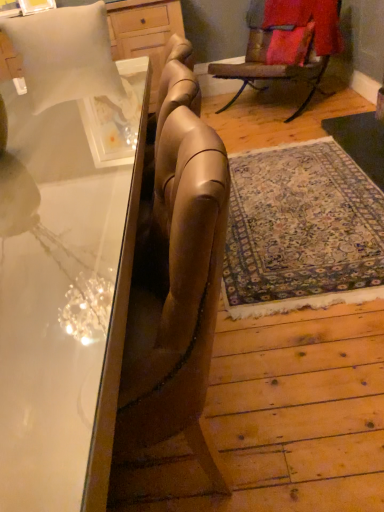
Question: From the image's perspective, is velvet red pillow at upper right, which is the 2th pillow in left-to-right order, below clear glass desk at left?

Choices:
 (A) no
 (B) yes

Answer: (A)

Question: Is velvet red pillow at upper right, which is the 2th pillow in left-to-right order, positioned far away from clear glass desk at left?

Choices:
 (A) yes
 (B) no

Answer: (A)

Question: Is velvet red pillow at upper right, which is the 2th pillow in left-to-right order, smaller than clear glass desk at left?

Choices:
 (A) yes
 (B) no

Answer: (A)

Question: Is velvet red pillow at upper right, positioned as the second pillow in bottom-to-top order, not within clear glass desk at left?

Choices:
 (A) yes
 (B) no

Answer: (A)

Question: From the image's perspective, is velvet red pillow at upper right, positioned as the second pillow in bottom-to-top order, over clear glass desk at left?

Choices:
 (A) no
 (B) yes

Answer: (B)

Question: Considering their positions, is clear glass desk at left located in front of or behind velvet red pillow at upper right, arranged as the first pillow when viewed from the top?

Choices:
 (A) front
 (B) behind

Answer: (A)

Question: From the image's perspective, is clear glass desk at left above or below velvet red pillow at upper right, marked as the first pillow in a right-to-left arrangement?

Choices:
 (A) above
 (B) below

Answer: (B)

Question: Based on their positions, is clear glass desk at left located to the left or right of velvet red pillow at upper right, the first pillow positioned from the back?

Choices:
 (A) left
 (B) right

Answer: (A)

Question: From a real-world perspective, is clear glass desk at left physically located above or below velvet red pillow at upper right, the second pillow when ordered from front to back?

Choices:
 (A) above
 (B) below

Answer: (B)

Question: Which is correct: wooden rocking chair at upper right is inside clear glass desk at left, or outside of it?

Choices:
 (A) outside
 (B) inside

Answer: (A)

Question: Is wooden rocking chair at upper right taller or shorter than clear glass desk at left?

Choices:
 (A) short
 (B) tall

Answer: (A)

Question: Is point pos(216,111) positioned closer to the camera than point pos(79,92)?

Choices:
 (A) farther
 (B) closer

Answer: (A)

Question: Is wooden rocking chair at upper right to the left or to the right of clear glass desk at left in the image?

Choices:
 (A) right
 (B) left

Answer: (A)

Question: Considering their positions, is wooden rocking chair at upper right located in front of or behind velvet red pillow at upper right, the first pillow positioned from the back?

Choices:
 (A) front
 (B) behind

Answer: (A)

Question: Is point (274, 10) positioned closer to the camera than point (246, 47)?

Choices:
 (A) closer
 (B) farther

Answer: (A)